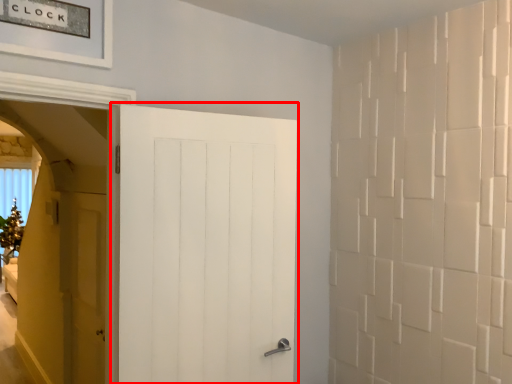
Question: From the image's perspective, where is door (annotated by the red box) located relative to door?

Choices:
 (A) below
 (B) above

Answer: (B)